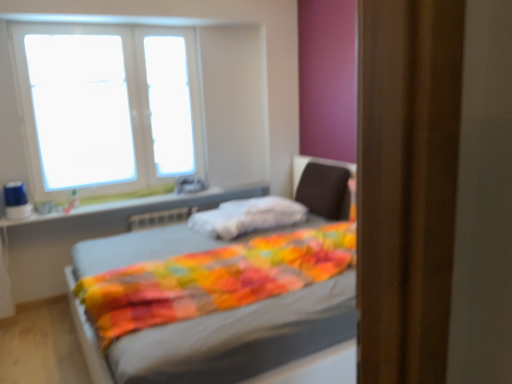
Question: From a real-world perspective, is multicolored quilted blanket at center physically above transparent glass window at upper center, the first window screen viewed from the right?

Choices:
 (A) yes
 (B) no

Answer: (B)

Question: Is multicolored quilted blanket at center turned away from transparent glass window at upper center, the first window screen viewed from the right?

Choices:
 (A) no
 (B) yes

Answer: (A)

Question: From the image's perspective, would you say multicolored quilted blanket at center is positioned over transparent glass window at upper center, the 2th window screen viewed from the left?

Choices:
 (A) no
 (B) yes

Answer: (A)

Question: Considering the relative sizes of multicolored quilted blanket at center and transparent glass window at upper center, the first window screen viewed from the right, in the image provided, is multicolored quilted blanket at center smaller than transparent glass window at upper center, the first window screen viewed from the right,?

Choices:
 (A) no
 (B) yes

Answer: (A)

Question: Would you say multicolored quilted blanket at center contains transparent glass window at upper center, the first window screen viewed from the right?

Choices:
 (A) no
 (B) yes

Answer: (A)

Question: From the image's perspective, is white plastic window sill at upper left located above or below white plastic window at upper left?

Choices:
 (A) below
 (B) above

Answer: (A)

Question: From a real-world perspective, is white plastic window sill at upper left positioned above or below white plastic window at upper left?

Choices:
 (A) above
 (B) below

Answer: (B)

Question: Is white plastic window sill at upper left taller or shorter than white plastic window at upper left?

Choices:
 (A) tall
 (B) short

Answer: (B)

Question: Does point (212, 205) appear closer or farther from the camera than point (198, 144)?

Choices:
 (A) farther
 (B) closer

Answer: (A)

Question: In the image, is multicolored quilted blanket at center on the left side or the right side of transparent glass window at upper center, the first window screen viewed from the right?

Choices:
 (A) left
 (B) right

Answer: (B)

Question: Which is correct: multicolored quilted blanket at center is inside transparent glass window at upper center, the first window screen viewed from the right, or outside of it?

Choices:
 (A) inside
 (B) outside

Answer: (B)

Question: Looking at their shapes, would you say multicolored quilted blanket at center is wider or thinner than transparent glass window at upper center, the first window screen viewed from the right?

Choices:
 (A) wide
 (B) thin

Answer: (A)

Question: Does point (210, 210) appear closer or farther from the camera than point (146, 51)?

Choices:
 (A) closer
 (B) farther

Answer: (B)

Question: From a real-world perspective, is multicolored quilted blanket at center positioned above or below dark brown fabric swivel chair at center?

Choices:
 (A) above
 (B) below

Answer: (B)

Question: Considering their positions, is multicolored quilted blanket at center located in front of or behind dark brown fabric swivel chair at center?

Choices:
 (A) behind
 (B) front

Answer: (B)